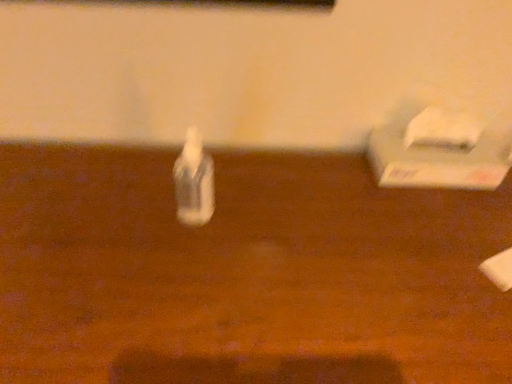
The image size is (512, 384). I want to click on vacant area that is situated to the right of transparent plastic bottle at center, so click(x=282, y=221).